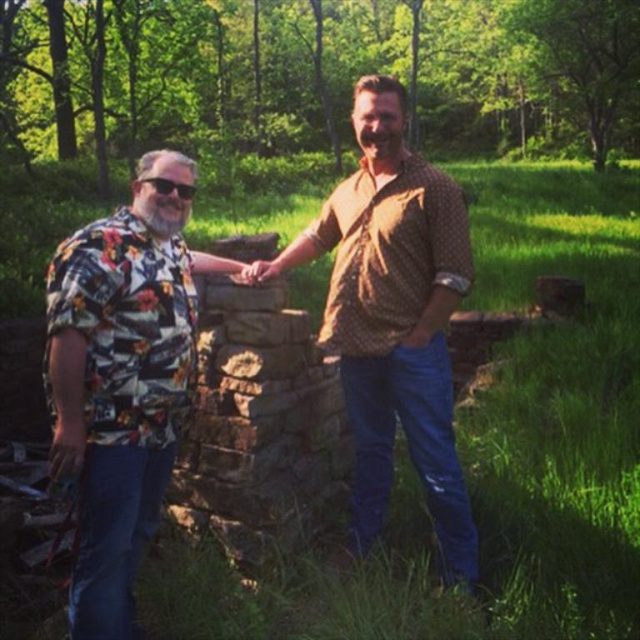
You are planning to take a photo of two friends in a forest setting. You need to ensure that both individuals are visible in the frame. Given that the floral print shirt at left is thinner than the brown dotted shirt at center, which person should you position closer to the camera to avoid them being overshadowed by the other?

The floral print shirt at left is thinner than the brown dotted shirt at center, so you should position the person wearing the floral print shirt at left closer to the camera to ensure they are not overshadowed by the other person.